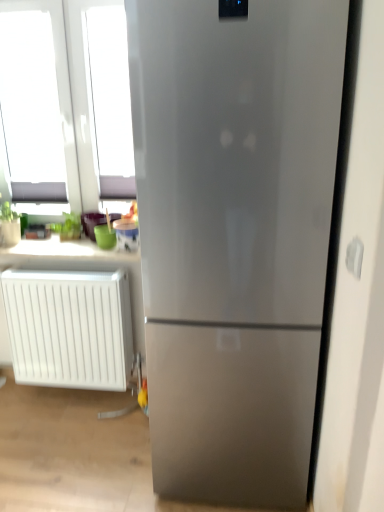
Question: From a real-world perspective, is matte white counter top at upper left located higher than white plastic electric outlet at right?

Choices:
 (A) no
 (B) yes

Answer: (A)

Question: Does matte white counter top at upper left have a larger size compared to white plastic electric outlet at right?

Choices:
 (A) yes
 (B) no

Answer: (A)

Question: Is matte white counter top at upper left at the right side of white plastic electric outlet at right?

Choices:
 (A) no
 (B) yes

Answer: (A)

Question: Would you say matte white counter top at upper left is a long distance from white plastic electric outlet at right?

Choices:
 (A) no
 (B) yes

Answer: (B)

Question: From a real-world perspective, is matte white counter top at upper left under white plastic electric outlet at right?

Choices:
 (A) yes
 (B) no

Answer: (A)

Question: Does point (69, 373) appear closer or farther from the camera than point (49, 245)?

Choices:
 (A) closer
 (B) farther

Answer: (A)

Question: In the image, is white plastic radiator at lower left positioned in front of or behind matte white counter top at upper left?

Choices:
 (A) behind
 (B) front

Answer: (B)

Question: Choose the correct answer: Is white plastic radiator at lower left inside matte white counter top at upper left or outside it?

Choices:
 (A) inside
 (B) outside

Answer: (B)

Question: Looking at their shapes, would you say white plastic radiator at lower left is wider or thinner than matte white counter top at upper left?

Choices:
 (A) thin
 (B) wide

Answer: (A)

Question: Would you say white plastic electric outlet at right is to the left or to the right of white plastic radiator at lower left in the picture?

Choices:
 (A) right
 (B) left

Answer: (A)

Question: Considering the positions of white plastic electric outlet at right and white plastic radiator at lower left in the image, is white plastic electric outlet at right wider or thinner than white plastic radiator at lower left?

Choices:
 (A) wide
 (B) thin

Answer: (B)

Question: In terms of height, does white plastic electric outlet at right look taller or shorter compared to white plastic radiator at lower left?

Choices:
 (A) short
 (B) tall

Answer: (A)

Question: From a real-world perspective, is white plastic electric outlet at right above or below white plastic radiator at lower left?

Choices:
 (A) above
 (B) below

Answer: (A)

Question: Is white plastic radiator at lower left wider or thinner than white plastic electric outlet at right?

Choices:
 (A) thin
 (B) wide

Answer: (B)

Question: From a real-world perspective, is white plastic radiator at lower left physically located above or below white plastic electric outlet at right?

Choices:
 (A) above
 (B) below

Answer: (B)